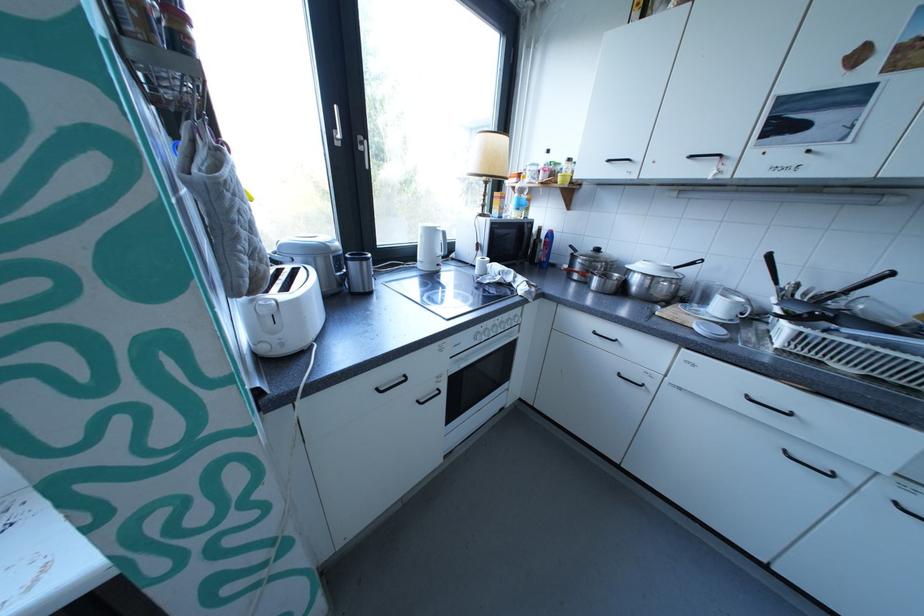
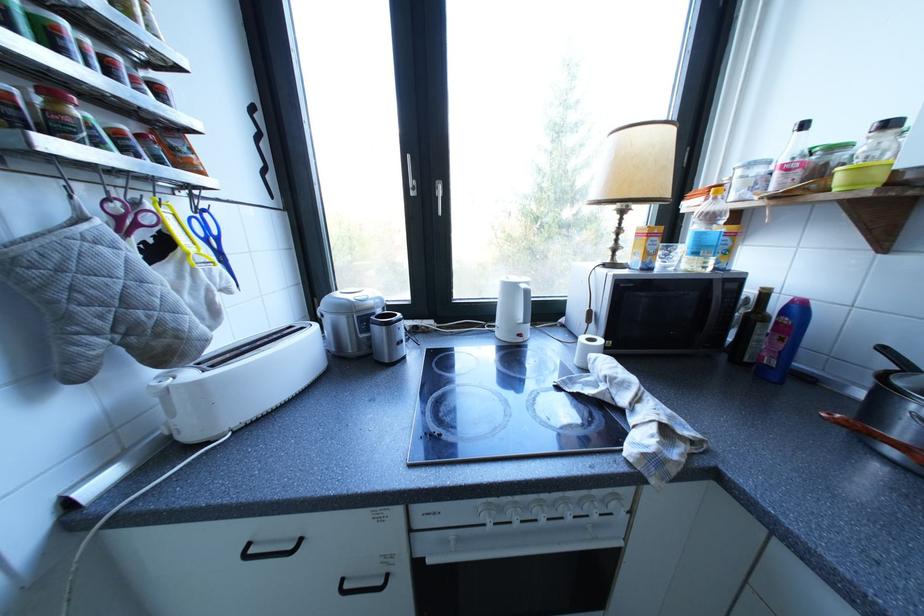
Find the pixel in the second image that matches [480,355] in the first image.

(470, 540)